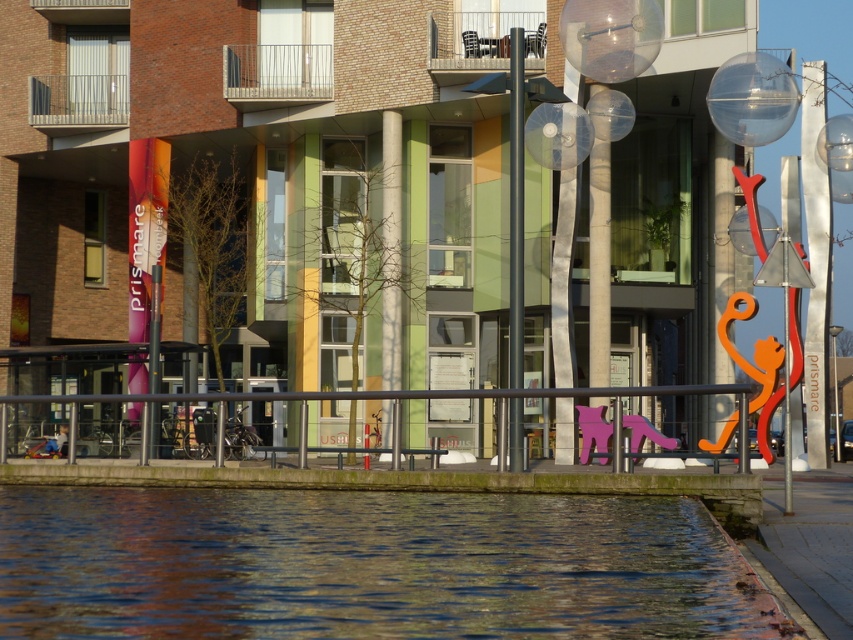
Question: Does black metal rail at lower center have a smaller size compared to polished metal pole at center?

Choices:
 (A) no
 (B) yes

Answer: (A)

Question: Is black metal rail at lower center below polished metal pole at center?

Choices:
 (A) yes
 (B) no

Answer: (A)

Question: Which point is closer to the camera taking this photo?

Choices:
 (A) pyautogui.click(x=198, y=490)
 (B) pyautogui.click(x=573, y=392)
 (C) pyautogui.click(x=520, y=301)

Answer: (B)

Question: Which object is positioned farthest from the polished metal pole at center?

Choices:
 (A) black metal rail at lower center
 (B) clear water at lower left

Answer: (B)

Question: Which object is farther from the camera taking this photo?

Choices:
 (A) polished metal pole at center
 (B) clear water at lower left
 (C) black metal rail at lower center

Answer: (A)

Question: Is clear water at lower left to the left of polished metal pole at center from the viewer's perspective?

Choices:
 (A) no
 (B) yes

Answer: (B)